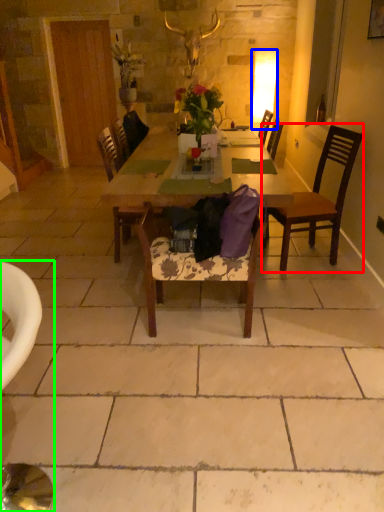
Question: Which is nearer to the chair (highlighted by a red box)? lamp (highlighted by a blue box) or chair (highlighted by a green box).

Choices:
 (A) lamp
 (B) chair

Answer: (B)